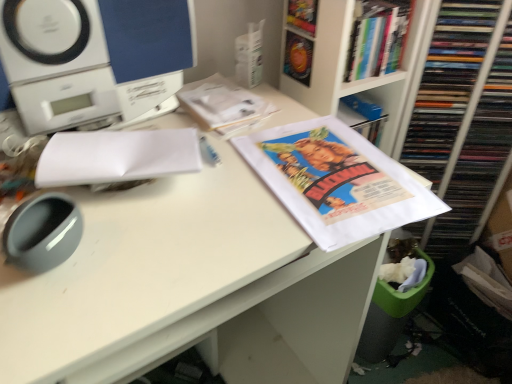
Locate an element on the screen. blank space situated above matte paper poster at center (from a real-world perspective) is located at coordinates (329, 165).